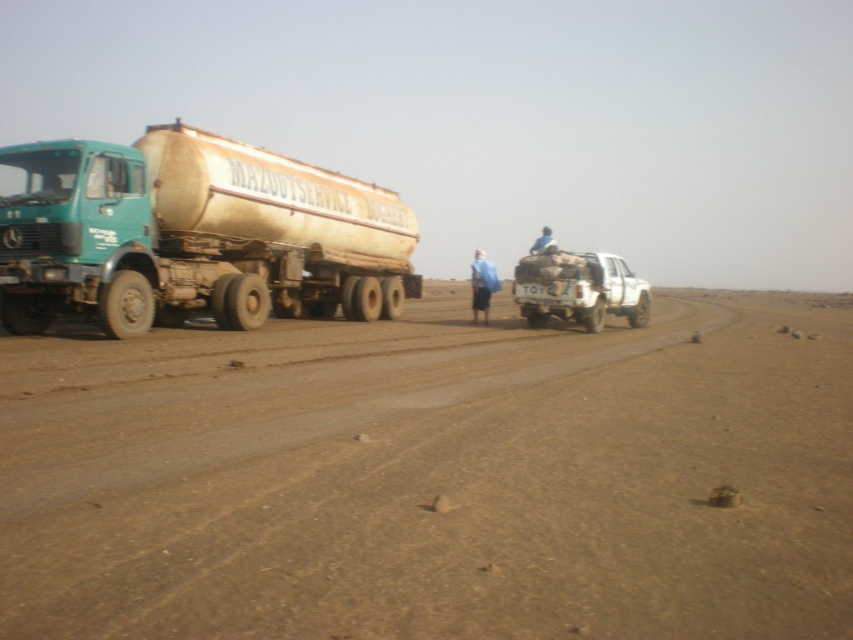
Consider the image. You are a delivery driver who needs to transport a large cargo container that requires a vehicle width of at least 2 meters. You see the white matte truck at center and the blue fabric at center in the image. Which vehicle can accommodate your cargo based on their widths?

The blue fabric at center is wider than the white matte truck at center, so the blue fabric at center can accommodate the cargo as it meets the minimum width requirement of 2 meters.

You are standing at the starting point of the dirt road in the rural landscape. There are two points marked on the road ahead of you. The first point is at coordinates point (558, 264) and the second point is at point (550, 236). If you were to walk along the road towards the truck, which point would you encounter first?

You would encounter point (558, 264) first because it is in front of point (550, 236) along the road towards the truck.

You are a hiker who wants to place a blue fabric bag at center on the ground. Based on the scene, will the brown sandy dirt at center be visible underneath the bag when placed there?

The brown sandy dirt at center is in front of blue fabric bag at center, meaning the dirt is closer to the viewer. Therefore, when placing the blue fabric bag at center on the ground, the brown sandy dirt at center will still be visible underneath the bag.